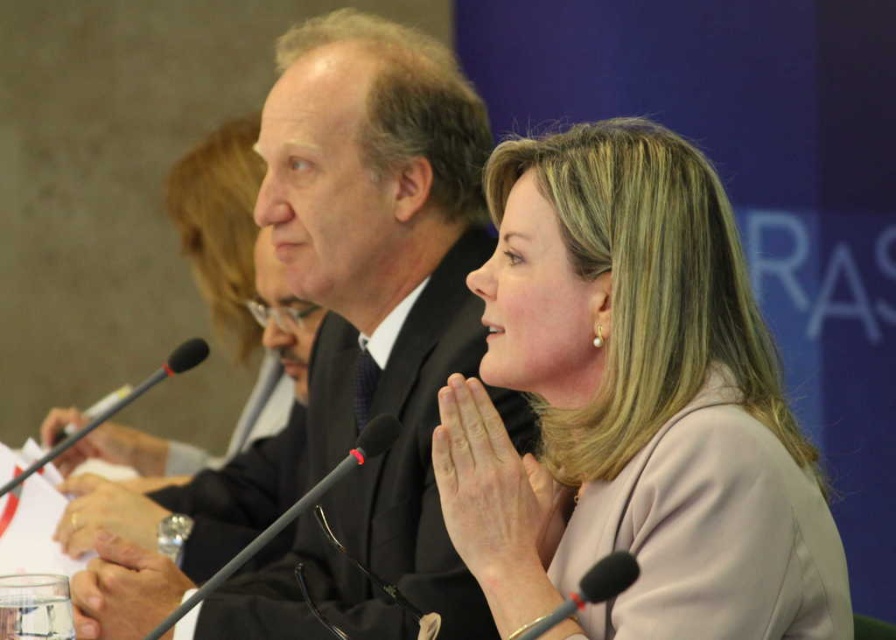
Does black matte microphone at center appear over black plastic microphone at lower left?

No.

Which is more to the right, black matte microphone at center or black plastic microphone at lower left?

black matte microphone at center

Locate an element on the screen. black matte microphone at center is located at coordinates (290, 513).

Can you confirm if black matte microphone at lower center is taller than black plastic microphone at lower left?

In fact, black matte microphone at lower center may be shorter than black plastic microphone at lower left.

How much distance is there between black matte microphone at lower center and black plastic microphone at lower left?

They are 32.55 inches apart.

Does point (530, 636) lie behind point (57, 444)?

No.

At what (x,y) coordinates should I click in order to perform the action: click on black matte microphone at lower center. Please return your answer as a coordinate pair (x, y). Looking at the image, I should click on (588, 592).

Can you confirm if pink fabric at center is positioned to the right of black matte microphone at center?

Correct, you'll find pink fabric at center to the right of black matte microphone at center.

Does pink fabric at center have a lesser height compared to black matte microphone at center?

No.

Does point (790, 488) lie in front of point (309, 492)?

Yes, it is in front of point (309, 492).

Image resolution: width=896 pixels, height=640 pixels. Identify the location of pink fabric at center. (633, 404).